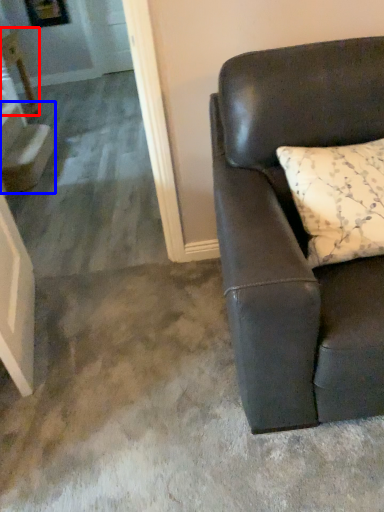
Question: Which object is further to the camera taking this photo, table (highlighted by a red box) or stairwell (highlighted by a blue box)?

Choices:
 (A) table
 (B) stairwell

Answer: (A)